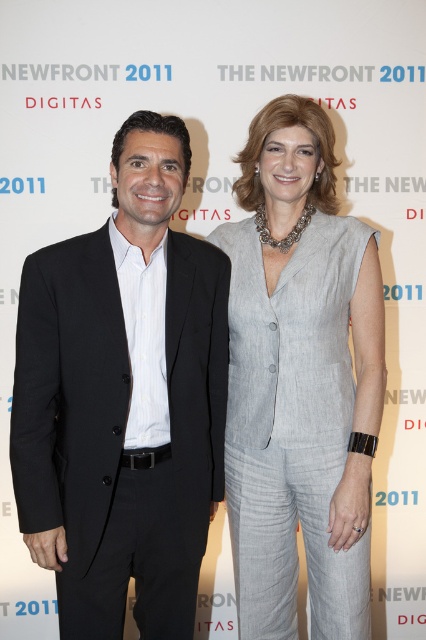
Is black smooth suit at left taller than light gray linen suit at center?

No, black smooth suit at left is not taller than light gray linen suit at center.

Can you confirm if black smooth suit at left is shorter than light gray linen suit at center?

Yes, black smooth suit at left is shorter than light gray linen suit at center.

Identify the location of black smooth suit at left. [123, 400].

Find the location of `black smooth suit at left`. black smooth suit at left is located at coordinates (123, 400).